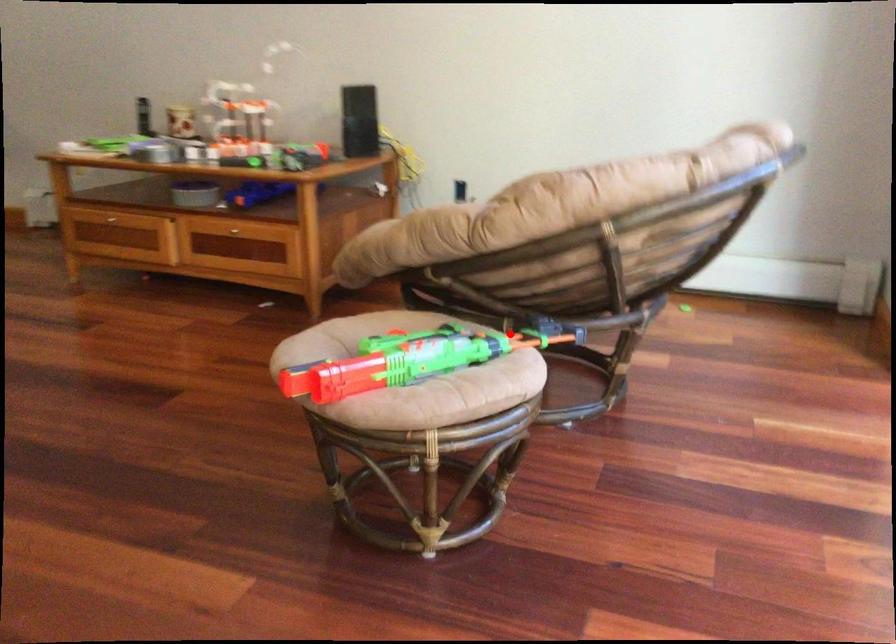
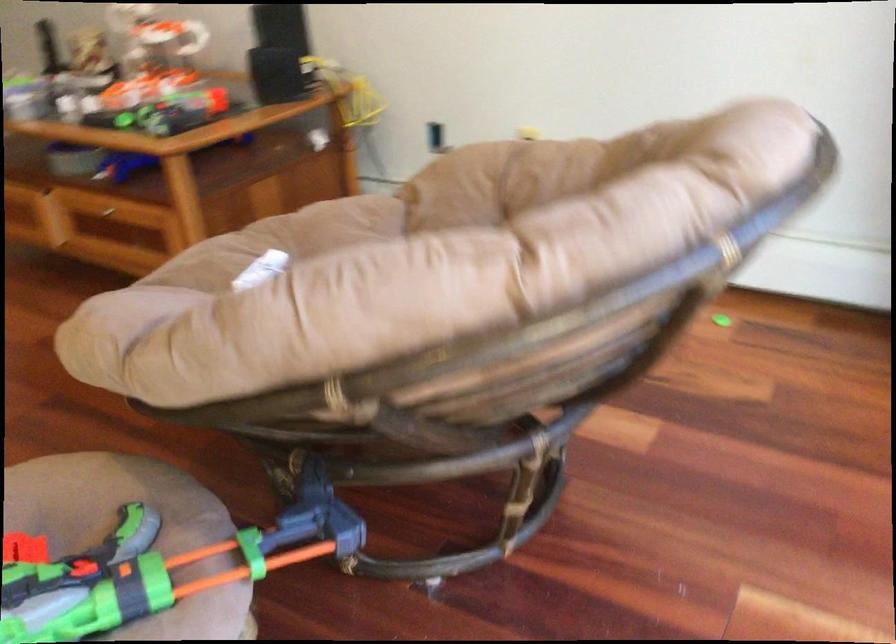
Question: I am providing you with two images of the same scene from different viewpoints. Image1 has a red point marked. In image2, the corresponding 3D location appears at what relative position? Reply with the corresponding letter.

Choices:
 (A) Closer
 (B) Farther

Answer: (A)